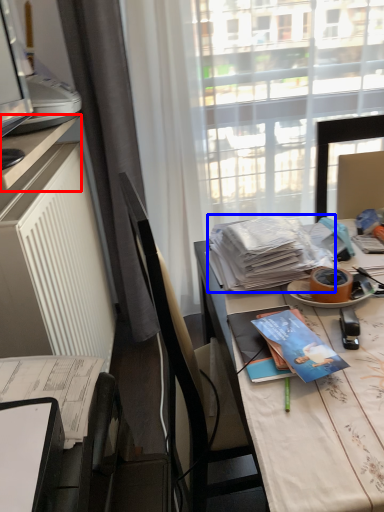
Question: Which object is closer to the camera taking this photo, desk (highlighted by a red box) or magazine (highlighted by a blue box)?

Choices:
 (A) desk
 (B) magazine

Answer: (A)